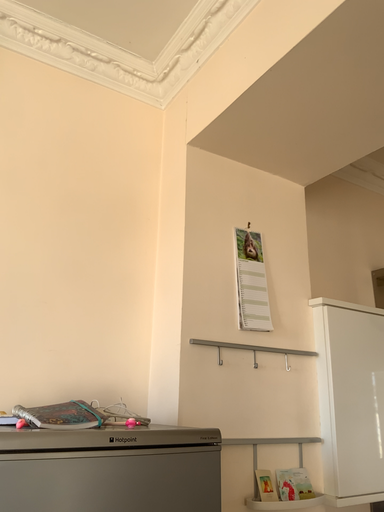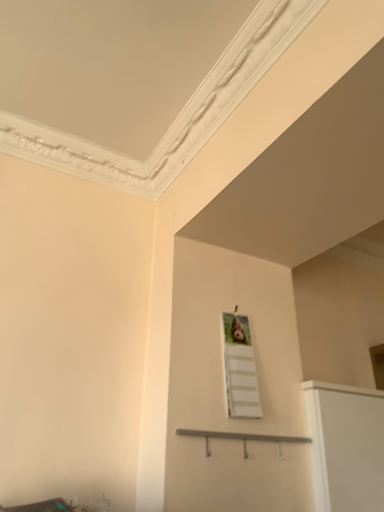
Question: How did the camera likely rotate when shooting the video?

Choices:
 (A) rotated downward
 (B) rotated upward

Answer: (B)